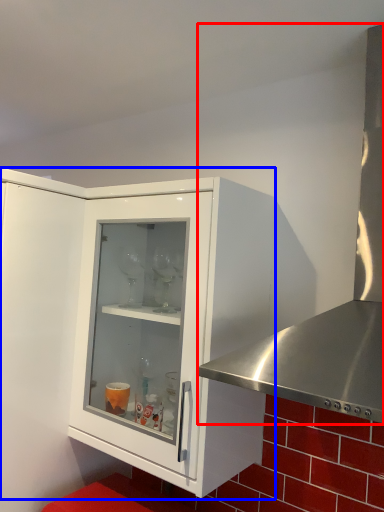
Question: Among these objects, which one is farthest to the camera, kitchen appliance (highlighted by a red box) or cabinetry (highlighted by a blue box)?

Choices:
 (A) kitchen appliance
 (B) cabinetry

Answer: (B)